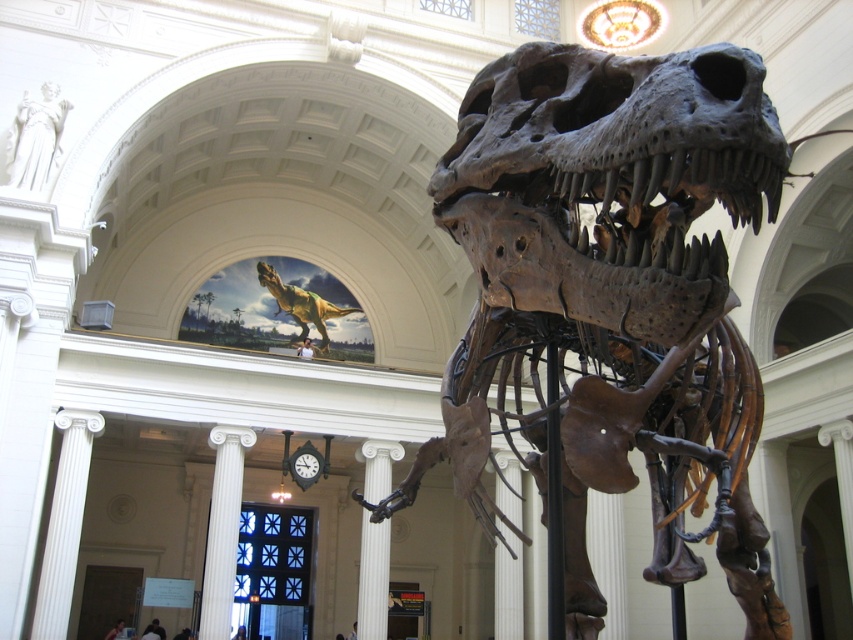
I want to click on white marble column at center, so click(222, 529).

Does white marble column at center have a larger size compared to green textured dinosaur at upper center?

Yes.

Who is more forward, (x=223, y=428) or (x=328, y=337)?

Point (x=223, y=428) is more forward.

You are a GUI agent. You are given a task and a screenshot of the screen. Output one action in this format:
    pyautogui.click(x=<x>, y=<y>)
    Task: Click on the white marble column at center
    The width and height of the screenshot is (853, 640).
    Given the screenshot: What is the action you would take?
    pyautogui.click(x=222, y=529)

Locate an element on the screen. This screenshot has width=853, height=640. white marble pillar at center is located at coordinates (373, 579).

What do you see at coordinates (373, 579) in the screenshot? I see `white marble pillar at center` at bounding box center [373, 579].

This screenshot has width=853, height=640. What do you see at coordinates (373, 579) in the screenshot?
I see `white marble pillar at center` at bounding box center [373, 579].

Locate an element on the screen. This screenshot has height=640, width=853. white marble pillar at center is located at coordinates (373, 579).

Is brown metallic skeleton at center shorter than white marble pillar at center?

Incorrect, brown metallic skeleton at center's height does not fall short of white marble pillar at center's.

Is point (425, 451) positioned behind point (375, 538)?

No.

Identify the location of brown metallic skeleton at center. (610, 305).